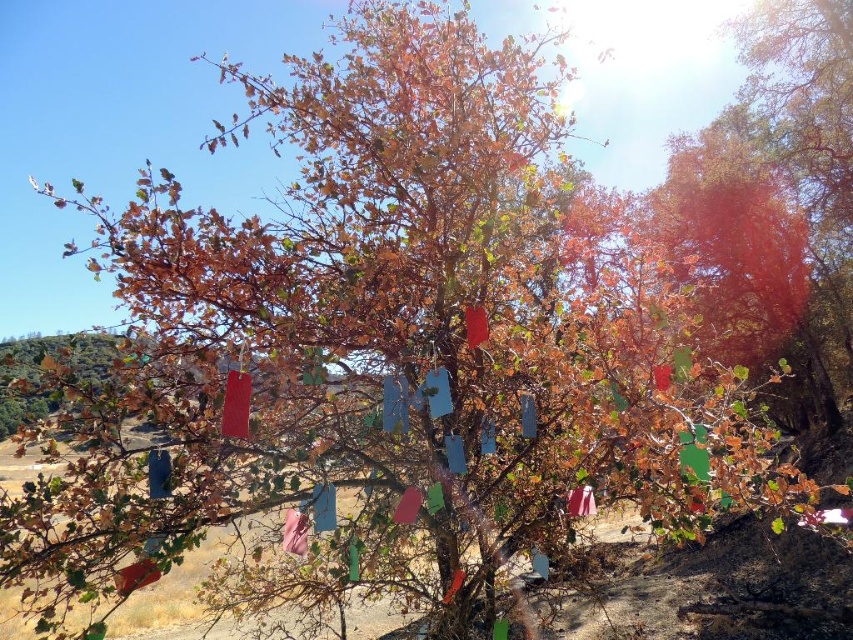
You are a hiker who wants to hang a new blue flag between the red matte flag at center and the pink fabric flag at center. Based on their current positions, which flag should you place the new blue flag to the left of?

The red matte flag at center is positioned on the left side of pink fabric flag at center, so you should place the new blue flag to the left of the pink fabric flag at center.

You are a hiker trying to locate two matte red flags in a semi arid environment. You see the matte red flag at center and the matte red flag at lower left. Which flag is closer to you?

Answer: The matte red flag at center is closer to you because it is in front of the matte red flag at lower left.